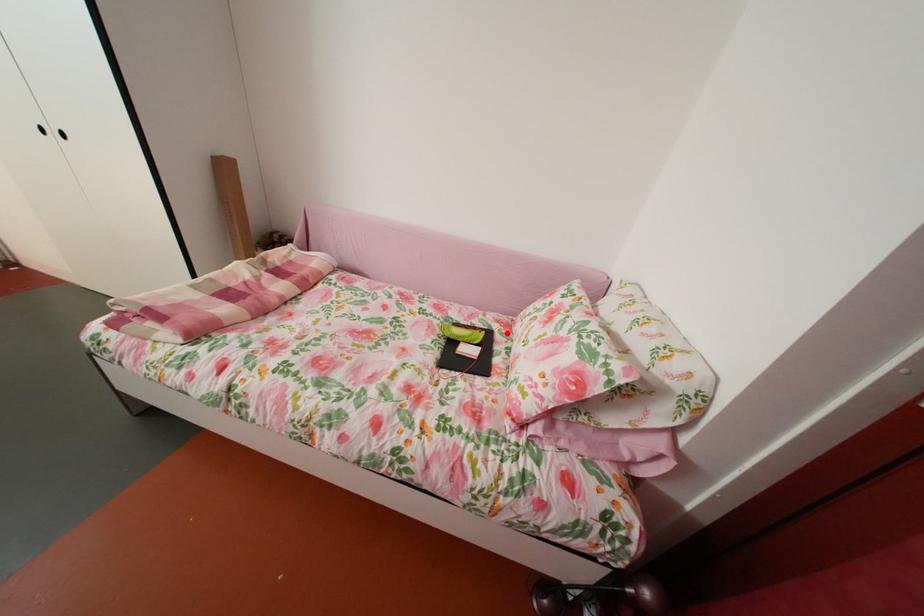
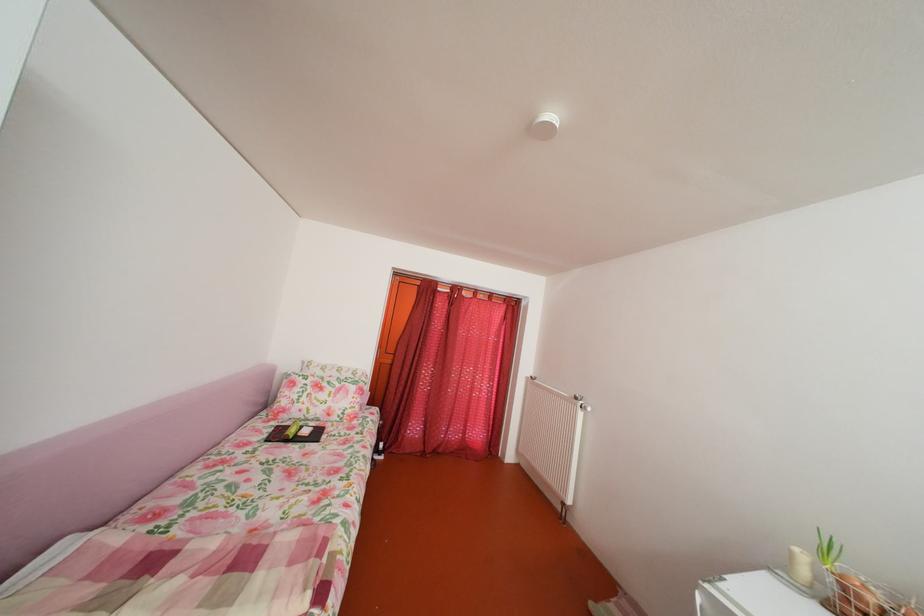
Find the pixel in the second image that matches the highlighted location in the first image.

(286, 430)